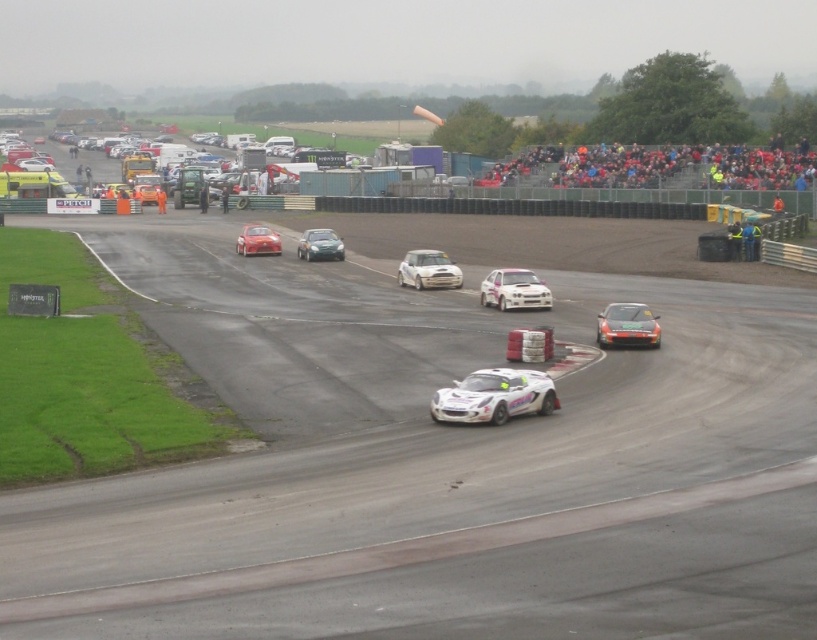
Does smooth asphalt race track at center have a larger size compared to white matte car at center?

Yes.

I want to click on smooth asphalt race track at center, so click(436, 467).

Can you confirm if white matte car at center is positioned to the right of shiny red car at center?

Indeed, white matte car at center is positioned on the right side of shiny red car at center.

Where is `white matte car at center`? This screenshot has height=640, width=817. white matte car at center is located at coordinates (427, 269).

Does point (418, 252) come farther from viewer compared to point (275, 234)?

No, it is not.

Identify the location of white matte car at center. The height and width of the screenshot is (640, 817). (427, 269).

Who is shorter, smooth asphalt race track at center or shiny red car at center?

Standing shorter between the two is shiny red car at center.

Is point (396, 500) in front of point (249, 252)?

That is True.

Identify the location of smooth asphalt race track at center. This screenshot has height=640, width=817. (436, 467).